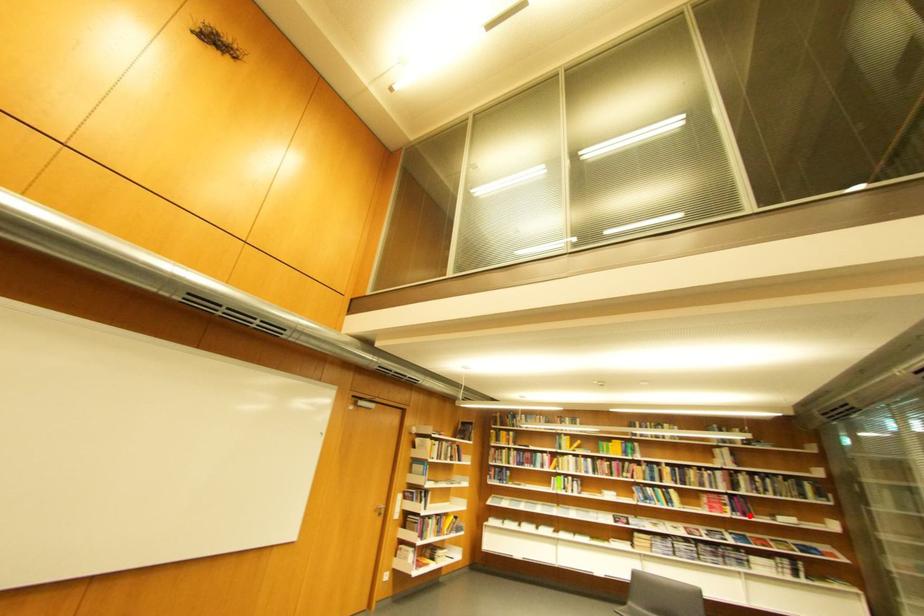
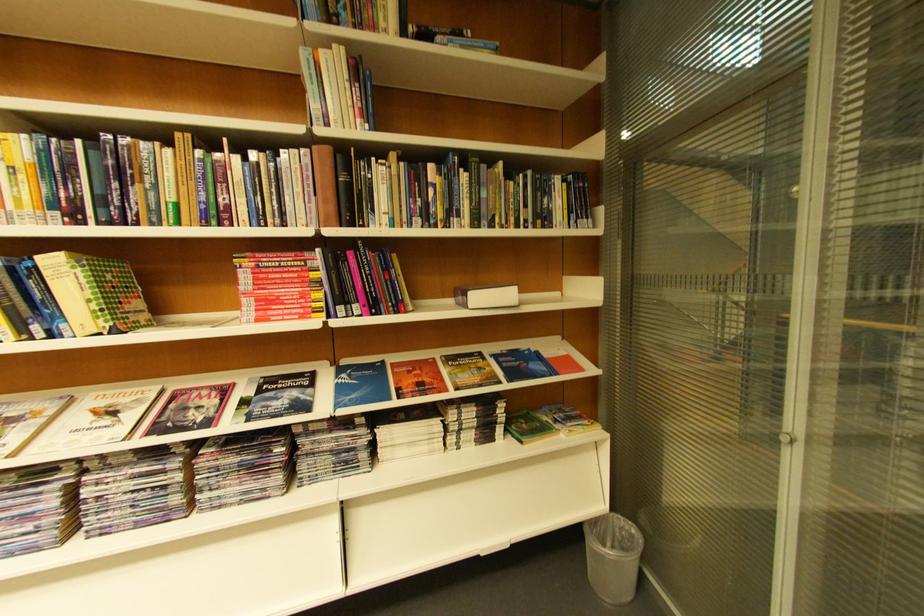
Locate, in the second image, the point that corresponds to the highlighted location in the first image.

(367, 310)